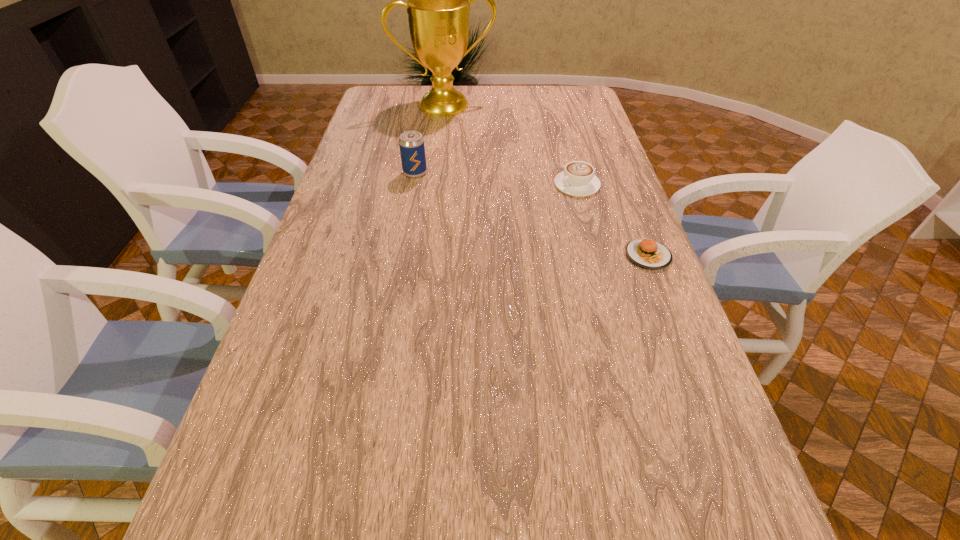
What are the coordinates of `beer can` in the screenshot? It's located at (411, 143).

You are a GUI agent. You are given a task and a screenshot of the screen. Output one action in this format:
    pyautogui.click(x=<x>, y=<y>)
    Task: Click on the rightmost object
    
    Given the screenshot: What is the action you would take?
    pyautogui.click(x=646, y=253)

Where is `the shortest object`? This screenshot has width=960, height=540. the shortest object is located at coordinates (646, 253).

This screenshot has height=540, width=960. Find the location of `the farthest object`. the farthest object is located at coordinates (438, 5).

This screenshot has height=540, width=960. I want to click on the tallest object, so click(438, 5).

Image resolution: width=960 pixels, height=540 pixels. Identify the location of the third tallest object. click(578, 179).

Locate an element on the screen. This screenshot has height=540, width=960. the second object from right to left is located at coordinates (578, 179).

Find the location of `vacant space located 0.270m on the right of the second tallest object`. vacant space located 0.270m on the right of the second tallest object is located at coordinates (509, 173).

Where is `vacant space located on the left of the food`? vacant space located on the left of the food is located at coordinates (569, 255).

Where is `vacant space located 0.210m on the shiny surface of the farthest object`? The image size is (960, 540). vacant space located 0.210m on the shiny surface of the farthest object is located at coordinates (476, 143).